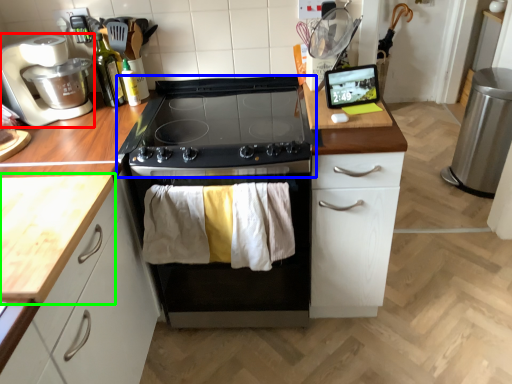
Question: Based on their relative distances, which object is nearer to kitchen appliance (highlighted by a red box)? Choose from gas stove (highlighted by a blue box) and countertop (highlighted by a green box).

Choices:
 (A) gas stove
 (B) countertop

Answer: (A)